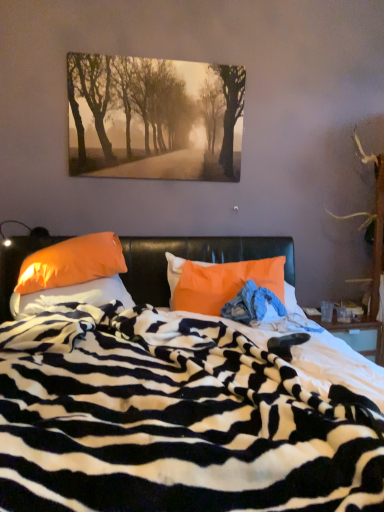
Find the location of a particular element. The width and height of the screenshot is (384, 512). orange fabric pillow at center, arranged as the third pillow when viewed from the left is located at coordinates (219, 282).

What do you see at coordinates (71, 275) in the screenshot?
I see `orange fabric pillow at left, which is the 2th pillow in right-to-left order` at bounding box center [71, 275].

This screenshot has height=512, width=384. What do you see at coordinates (172, 420) in the screenshot?
I see `zebra-patterned fabric at center` at bounding box center [172, 420].

The width and height of the screenshot is (384, 512). What do you see at coordinates (71, 296) in the screenshot? I see `orange fabric pillow at left, arranged as the 3th pillow when viewed from the right` at bounding box center [71, 296].

The height and width of the screenshot is (512, 384). What do you see at coordinates (252, 304) in the screenshot? I see `blue denim jeans at center` at bounding box center [252, 304].

Identify the location of matte paper print at upper center. (154, 118).

Is orange fabric pillow at left, arranged as the 3th pillow when viewed from the right, aimed at matte paper print at upper center?

No, orange fabric pillow at left, arranged as the 3th pillow when viewed from the right, is not facing towards matte paper print at upper center.

Is orange fabric pillow at left, placed as the 1th pillow when sorted from left to right, not near matte paper print at upper center?

Yes.

Which is closer, (158, 507) or (281, 306)?

Clearly, point (158, 507) is closer to the camera than point (281, 306).

The height and width of the screenshot is (512, 384). Find the location of `bed lying below the blue denim jeans at center (from the image's perspective)`. bed lying below the blue denim jeans at center (from the image's perspective) is located at coordinates (172, 420).

Can you confirm if zebra-patterned fabric at center is smaller than blue denim jeans at center?

No.

Could blue denim jeans at center be considered to be inside zebra-patterned fabric at center?

Yes, blue denim jeans at center can be found within zebra-patterned fabric at center.

Is orange fabric pillow at left, which is the 2th pillow in right-to-left order, closer to the viewer compared to zebra-patterned fabric at center?

No, it is not.

The image size is (384, 512). Identify the location of the 2nd pillow behind the zebra-patterned fabric at center. (71, 275).

Which of these two, orange fabric pillow at left, acting as the 2th pillow starting from the left, or zebra-patterned fabric at center, is wider?

zebra-patterned fabric at center.

Does orange fabric pillow at center, arranged as the first pillow when viewed from the right, touch orange fabric pillow at left, acting as the 2th pillow starting from the left?

No, orange fabric pillow at center, arranged as the first pillow when viewed from the right, is not next to orange fabric pillow at left, acting as the 2th pillow starting from the left.

Considering the positions of objects orange fabric pillow at center, arranged as the first pillow when viewed from the right, and orange fabric pillow at left, which is the 2th pillow in right-to-left order, in the image provided, who is more to the left, orange fabric pillow at center, arranged as the first pillow when viewed from the right, or orange fabric pillow at left, which is the 2th pillow in right-to-left order,?

orange fabric pillow at left, which is the 2th pillow in right-to-left order.

Which is behind, point (173, 263) or point (45, 298)?

The point (173, 263) is behind.

Based on the photo, from a real-world perspective, is matte paper print at upper center over orange fabric pillow at left, arranged as the 3th pillow when viewed from the right?

Yes, from a real-world perspective, matte paper print at upper center is over orange fabric pillow at left, arranged as the 3th pillow when viewed from the right

Can you tell me how much matte paper print at upper center and orange fabric pillow at left, arranged as the 3th pillow when viewed from the right, differ in facing direction?

0.467 degrees separate the facing orientations of matte paper print at upper center and orange fabric pillow at left, arranged as the 3th pillow when viewed from the right.

Which object is thinner, matte paper print at upper center or orange fabric pillow at left, placed as the 1th pillow when sorted from left to right?

matte paper print at upper center is thinner.

Would you say matte paper print at upper center is inside or outside orange fabric pillow at left, arranged as the 3th pillow when viewed from the right?

matte paper print at upper center is located beyond the bounds of orange fabric pillow at left, arranged as the 3th pillow when viewed from the right.

Is matte paper print at upper center thinner than zebra-patterned fabric at center?

Yes, matte paper print at upper center is thinner than zebra-patterned fabric at center.

Is matte paper print at upper center taller than zebra-patterned fabric at center?

No, matte paper print at upper center is not taller than zebra-patterned fabric at center.

Is matte paper print at upper center next to zebra-patterned fabric at center and touching it?

matte paper print at upper center and zebra-patterned fabric at center are clearly separated.

Is matte paper print at upper center at the right side of zebra-patterned fabric at center?

In fact, matte paper print at upper center is to the left of zebra-patterned fabric at center.

Considering the sizes of orange fabric pillow at center, arranged as the first pillow when viewed from the right, and zebra-patterned fabric at center in the image, is orange fabric pillow at center, arranged as the first pillow when viewed from the right, wider or thinner than zebra-patterned fabric at center?

In the image, orange fabric pillow at center, arranged as the first pillow when viewed from the right, appears to be more narrow than zebra-patterned fabric at center.

Who is smaller, orange fabric pillow at center, arranged as the first pillow when viewed from the right, or zebra-patterned fabric at center?

Smaller between the two is orange fabric pillow at center, arranged as the first pillow when viewed from the right.

Do you think orange fabric pillow at center, arranged as the third pillow when viewed from the left, is within zebra-patterned fabric at center, or outside of it?

orange fabric pillow at center, arranged as the third pillow when viewed from the left, is contained in zebra-patterned fabric at center.

I want to click on picture frame located on the right of orange fabric pillow at left, arranged as the 3th pillow when viewed from the right, so click(x=154, y=118).

Locate an element on the screen. material behind the zebra-patterned fabric at center is located at coordinates (252, 304).

Based on their spatial positions, is matte paper print at upper center or blue denim jeans at center closer to orange fabric pillow at center, arranged as the third pillow when viewed from the left?

blue denim jeans at center is closer to orange fabric pillow at center, arranged as the third pillow when viewed from the left.

Based on their spatial positions, is zebra-patterned fabric at center or orange fabric pillow at left, acting as the 2th pillow starting from the left, further from matte paper print at upper center?

zebra-patterned fabric at center is further to matte paper print at upper center.

Looking at the image, which one is located closer to matte paper print at upper center, orange fabric pillow at center, arranged as the third pillow when viewed from the left, or orange fabric pillow at left, which is the 2th pillow in right-to-left order?

orange fabric pillow at left, which is the 2th pillow in right-to-left order.

Looking at the image, which one is located further to orange fabric pillow at left, which is the 2th pillow in right-to-left order, matte paper print at upper center or zebra-patterned fabric at center?

matte paper print at upper center lies further to orange fabric pillow at left, which is the 2th pillow in right-to-left order, than the other object.

Which object lies further to the anchor point blue denim jeans at center, orange fabric pillow at left, arranged as the 3th pillow when viewed from the right, or orange fabric pillow at left, acting as the 2th pillow starting from the left?

orange fabric pillow at left, acting as the 2th pillow starting from the left, is positioned further to the anchor blue denim jeans at center.

From the image, which object appears to be farther from orange fabric pillow at left, placed as the 1th pillow when sorted from left to right, orange fabric pillow at center, arranged as the third pillow when viewed from the left, or blue denim jeans at center?

The object further to orange fabric pillow at left, placed as the 1th pillow when sorted from left to right, is blue denim jeans at center.

When comparing their distances from blue denim jeans at center, does matte paper print at upper center or orange fabric pillow at center, arranged as the first pillow when viewed from the right, seem further?

matte paper print at upper center lies further to blue denim jeans at center than the other object.

When comparing their distances from orange fabric pillow at left, arranged as the 3th pillow when viewed from the right, does matte paper print at upper center or blue denim jeans at center seem further?

The object further to orange fabric pillow at left, arranged as the 3th pillow when viewed from the right, is matte paper print at upper center.

At what (x,y) coordinates should I click in order to perform the action: click on material between zebra-patterned fabric at center and orange fabric pillow at left, acting as the 2th pillow starting from the left, from front to back. Please return your answer as a coordinate pair (x, y). Looking at the image, I should click on (252, 304).

What are the coordinates of `pillow between matte paper print at upper center and orange fabric pillow at center, arranged as the first pillow when viewed from the right, vertically` in the screenshot? It's located at (71, 275).

Find the location of `material positioned between zebra-patterned fabric at center and matte paper print at upper center from near to far`. material positioned between zebra-patterned fabric at center and matte paper print at upper center from near to far is located at coordinates (252, 304).

What are the coordinates of `pillow between orange fabric pillow at left, arranged as the 3th pillow when viewed from the right, and orange fabric pillow at center, arranged as the first pillow when viewed from the right, from left to right` in the screenshot? It's located at tap(71, 275).